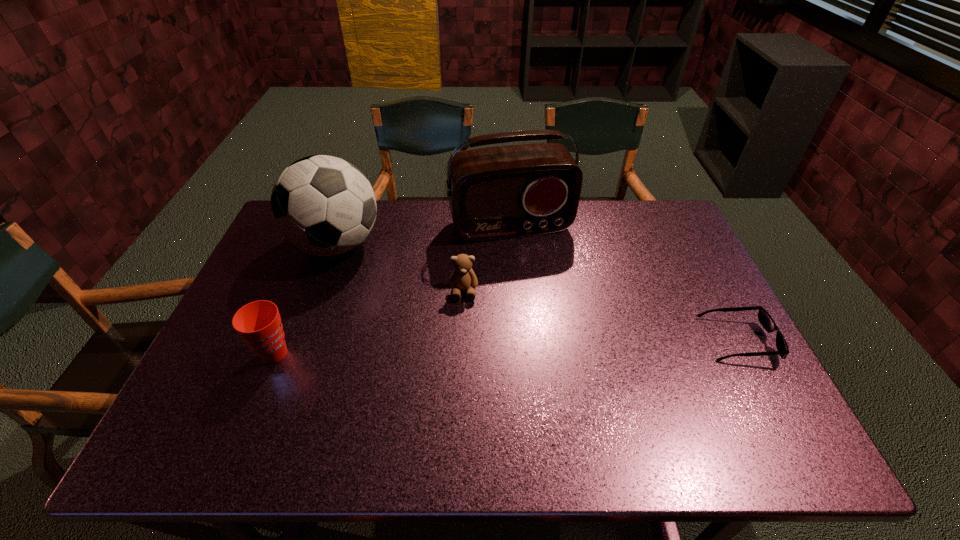
In order to click on free spot on the desktop that is between the cup and the shortest object and is positioned on the main logo of the soccer ball in this screenshot , I will do `click(453, 348)`.

This screenshot has width=960, height=540. What are the coordinates of `free space on the desktop that is between the cup and the rightmost object and is positioned on the front panel of the radio receiver` in the screenshot? It's located at (555, 346).

Identify the location of vacant spot on the desktop that is between the third tallest object and the rightmost object and is positioned on the face of the second shortest object. (465, 348).